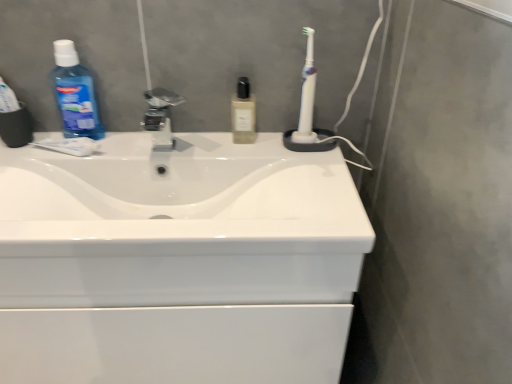
Image resolution: width=512 pixels, height=384 pixels. In order to click on free space that is in between satin nickel faucet at center and white plastic toothbrush at upper right in this screenshot , I will do `click(228, 140)`.